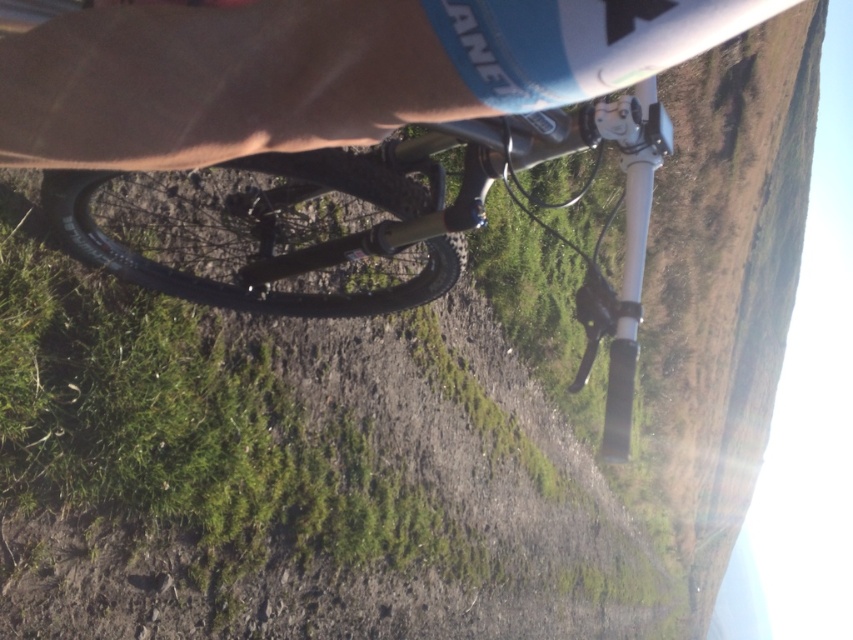
Consider the image. You are looking at the mountain bike from the rider perspective. There is a point at coordinates (312, 72). What object is located at that point?

The brown fabric at upper center is located at point (312, 72).

You are a photographer trying to capture the mountain bike scene. The brown fabric at upper center is blocking part of the lens flare on the right. To get a clear shot of the lens flare, should you move the camera slightly to the left or right?

Since the brown fabric at upper center is located at point (312, 72), moving the camera to the right would shift the frame to avoid the obstruction, allowing the lens flare on the right to be captured clearly.

You are riding a mountain bike on a dirt path and notice a brown fabric at upper center and a shiny metallic bicycle at center in your view. Which object is closer to you?

The brown fabric at upper center is closer to you because it is in front of the shiny metallic bicycle at center.